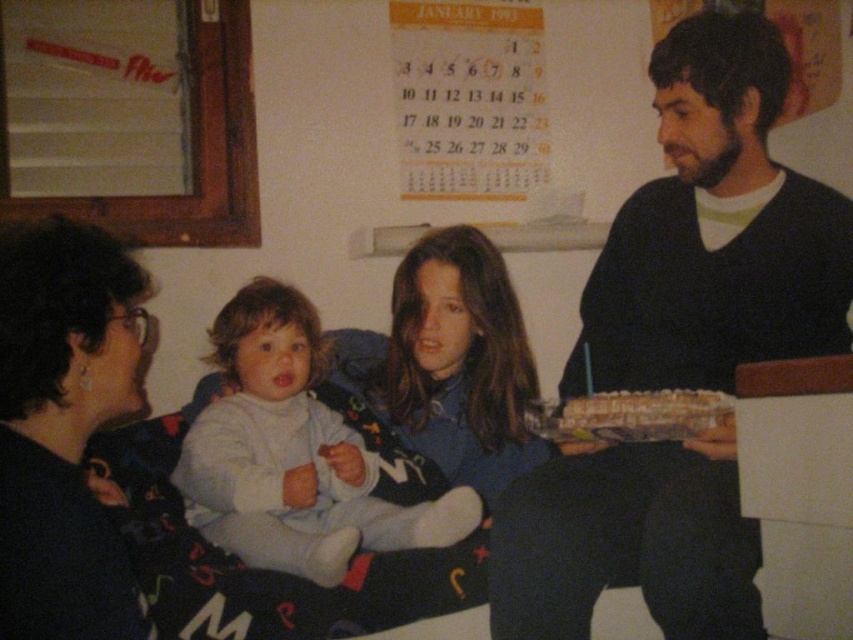
Which is behind, point (241, 493) or point (447, 324)?

Positioned behind is point (447, 324).

Between light blue fabric baby at center and matte blue sweater at center, which one has less height?

With less height is light blue fabric baby at center.

Find the location of a particular element. The width and height of the screenshot is (853, 640). light blue fabric baby at center is located at coordinates (292, 454).

You are a GUI agent. You are given a task and a screenshot of the screen. Output one action in this format:
    pyautogui.click(x=<x>, y=<y>)
    Task: Click on the light blue fabric baby at center
    This screenshot has width=853, height=640.
    Given the screenshot: What is the action you would take?
    pyautogui.click(x=292, y=454)

Does dark blue fabric at left appear on the right side of light blue fabric baby at center?

In fact, dark blue fabric at left is to the left of light blue fabric baby at center.

Is dark blue fabric at left closer to the viewer compared to light blue fabric baby at center?

Yes, it is in front of light blue fabric baby at center.

Between point (112, 570) and point (422, 518), which one is positioned behind?

Positioned behind is point (422, 518).

What are the coordinates of `dark blue fabric at left` in the screenshot? It's located at (64, 428).

Between point (125, 616) and point (460, 362), which one is positioned behind?

Point (460, 362)

Based on the photo, who is higher up, dark blue fabric at left or matte blue sweater at center?

matte blue sweater at center is above.

What do you see at coordinates (64, 428) in the screenshot?
I see `dark blue fabric at left` at bounding box center [64, 428].

Locate an element on the screen. The width and height of the screenshot is (853, 640). dark blue fabric at left is located at coordinates (64, 428).